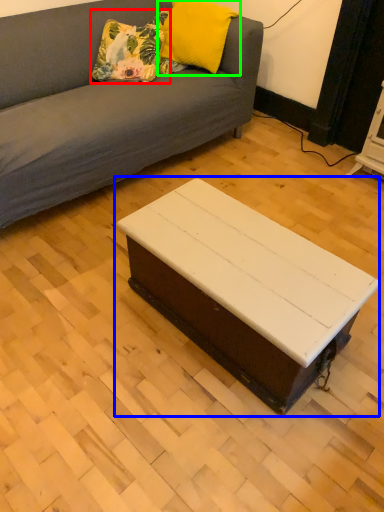
Question: Considering the real-world distances, which object is farthest from pillow (highlighted by a red box)? coffee table (highlighted by a blue box) or pillow (highlighted by a green box)?

Choices:
 (A) coffee table
 (B) pillow

Answer: (A)